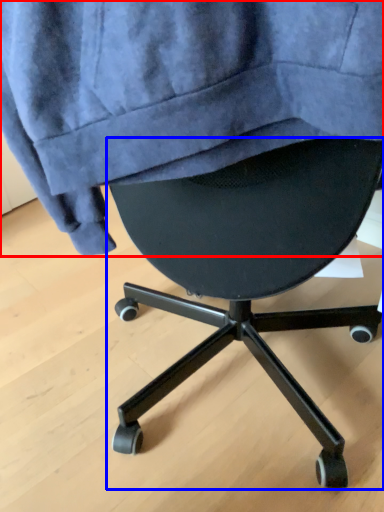
Question: Among these objects, which one is farthest to the camera, sweatshirt (highlighted by a red box) or chair (highlighted by a blue box)?

Choices:
 (A) sweatshirt
 (B) chair

Answer: (B)